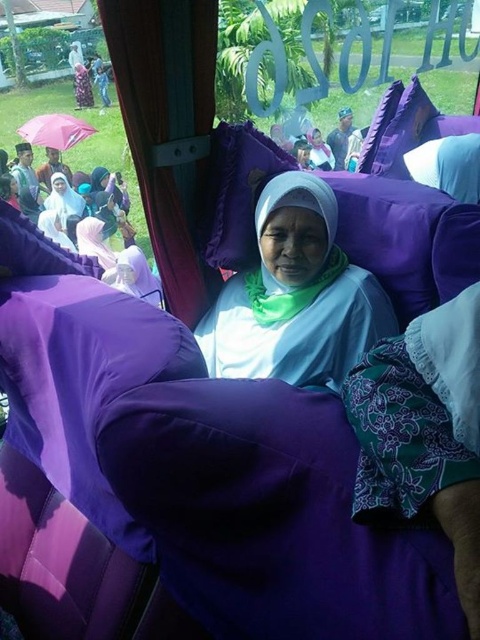
Question: Is matte white hijab at center smaller than matte purple hijab at center?

Choices:
 (A) no
 (B) yes

Answer: (B)

Question: Where is matte white hijab at center located in relation to purple fabric curtain at left in the image?

Choices:
 (A) above
 (B) below

Answer: (B)

Question: Which object is farther from the camera taking this photo?

Choices:
 (A) matte white hijab at center
 (B) matte white hijab at upper left
 (C) purple fabric curtain at left
 (D) pink fabric umbrella at upper left

Answer: (D)

Question: Which of the following is the closest to the observer?

Choices:
 (A) matte white hijab at center
 (B) pink fabric umbrella at upper left

Answer: (A)

Question: Can you confirm if pink fabric umbrella at upper left is bigger than matte purple hijab at center?

Choices:
 (A) yes
 (B) no

Answer: (A)

Question: Based on their relative distances, which object is nearer to the purple fabric curtain at left?

Choices:
 (A) matte purple hijab at center
 (B) pink fabric umbrella at upper left
 (C) matte white hijab at upper left

Answer: (C)